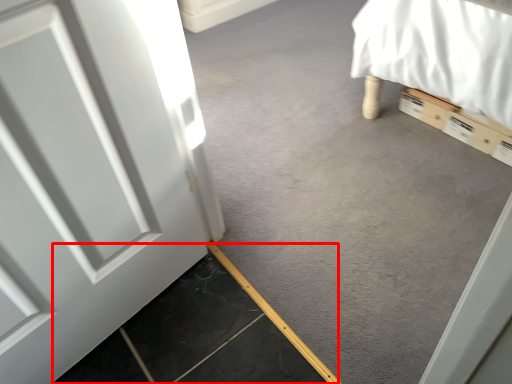
Question: From the image, what is the correct spatial relationship of concrete (annotated by the red box) in relation to concrete?

Choices:
 (A) right
 (B) left

Answer: (B)